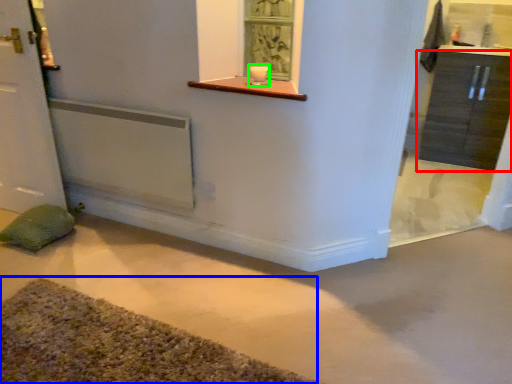
Question: Which is nearer to the cabinetry (highlighted by a red box)? bath mat (highlighted by a blue box) or candle holder (highlighted by a green box).

Choices:
 (A) bath mat
 (B) candle holder

Answer: (B)